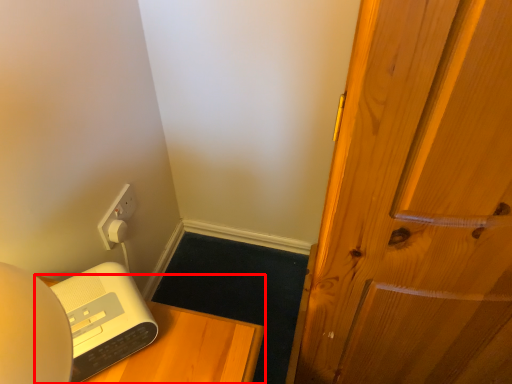
Question: From the image's perspective, what is the correct spatial relationship of furniture (annotated by the red box) in relation to appliance?

Choices:
 (A) above
 (B) below

Answer: (B)